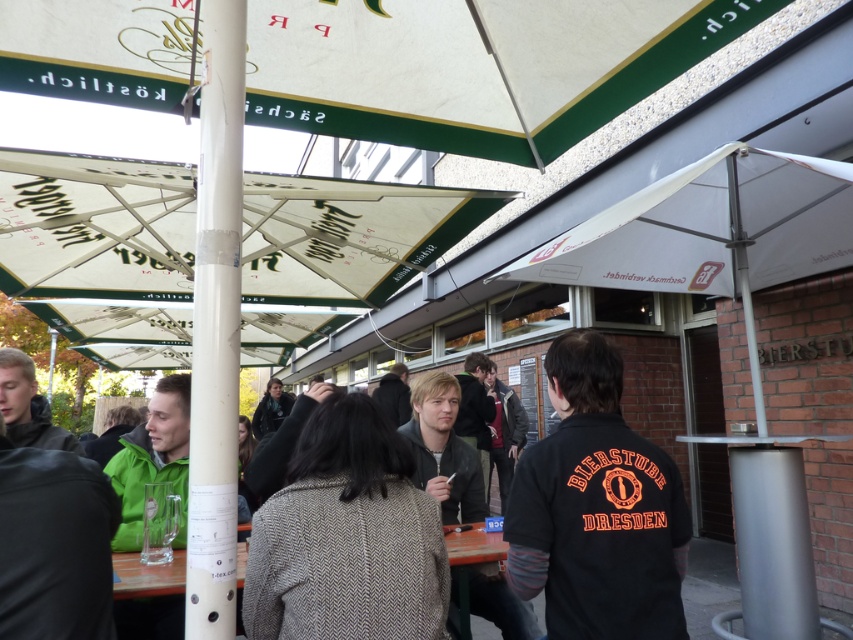
From the picture: You are standing in the outdoor seating area of the Bierstube Dresden. You notice two points marked in the scene. The first point is at coordinates point (44, 448) and the second point is at coordinates point (265, 417). Which point is closer to you?

Point (44, 448) is closer to the camera than point (265, 417), so the first point is closer to you.

You are standing at the entrance of the BIERSTUBE DRESDEN and want to locate the white textured canopy at upper center. Based on the coordinates provided, which direction should you face to see it?

The white textured canopy at upper center is located at coordinates 0.105 on the x axis and 0.557 on the y axis. Since the x value is less than 0.5, it is positioned to the left side of the image. The y value of 0.557 places it near the center vertically. Therefore, you should face towards the upper left direction to see the white textured canopy at upper center.

You are a tailor who needs to determine which garment is more appropriate for a customer who prefers shorter outerwear. Based on the scene, which item would you recommend between the dark gray jacket at left and the dark gray wool coat at center?

The dark gray jacket at left is shorter than the dark gray wool coat at center, so the dark gray jacket at left would be more appropriate for someone preferring shorter outerwear.